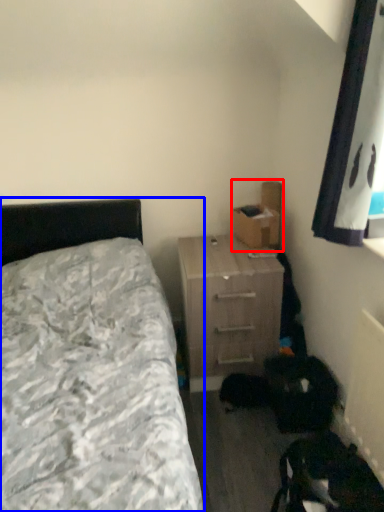
Question: Which object is closer to the camera taking this photo, cardboard box (highlighted by a red box) or bed (highlighted by a blue box)?

Choices:
 (A) cardboard box
 (B) bed

Answer: (B)